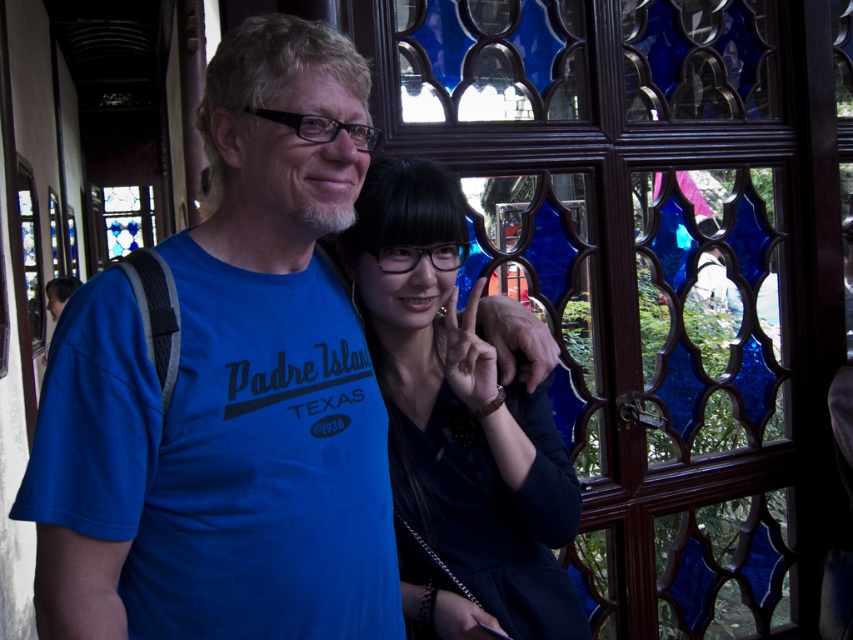
You are an interior designer working on a project and need to place a new desk in this room. The desk requires a clear space of 1.2 meters in front of it. Given the location of the blue stained glass at center, where should you position the desk to ensure it faces the stained glass while maintaining the required clearance?

The blue stained glass at center is located at point (659, 269). To position the desk facing the stained glass with 1.2 meters clearance, place the desk approximately 1.2 meters away from the stained glass, ensuring it is centered and aligned towards the coordinates provided.

You are a tour guide standing in front of the blue stained glass at center. You need to explain to visitors how far they should stand to get a clear view of the intricate details. Based on the information provided, what is the recommended distance?

The blue stained glass at center is 7.62 feet away from the viewer, so visitors should stand approximately 7.62 feet away to get a clear view of the intricate details.

You are standing in front of the decorative window and want to place a small plant between the two points, point (705, 445) and point (498, 378). Which point should the plant be closer to in order to be closer to the viewer?

The plant should be closer to point (705, 445) because it is further to the viewer than point (498, 378).